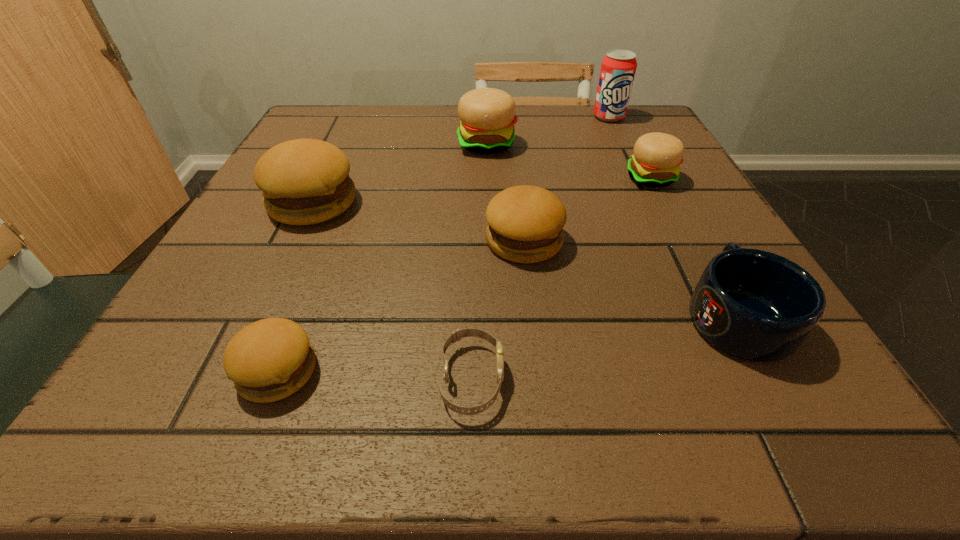
The width and height of the screenshot is (960, 540). What are the coordinates of `free space that is in between the soda can and the biggest brown hamburger` in the screenshot? It's located at (461, 160).

You are a GUI agent. You are given a task and a screenshot of the screen. Output one action in this format:
    pyautogui.click(x=<x>, y=<y>)
    Task: Click on the free space between the second smallest brown hamburger and the biggest brown hamburger
    
    Given the screenshot: What is the action you would take?
    pyautogui.click(x=419, y=221)

You are a GUI agent. You are given a task and a screenshot of the screen. Output one action in this format:
    pyautogui.click(x=<x>, y=<y>)
    Task: Click on the vacant region between the rightmost hamburger and the shortest object
    The image size is (960, 540).
    Given the screenshot: What is the action you would take?
    pyautogui.click(x=562, y=279)

Identify the location of vacant area that lies between the nearer beige hamburger and the blue mug. (693, 247).

This screenshot has height=540, width=960. What are the coordinates of `free space between the watch and the biggest brown hamburger` in the screenshot? It's located at (392, 291).

Find the location of a particular element. free space between the right beige hamburger and the biggest brown hamburger is located at coordinates (482, 191).

Image resolution: width=960 pixels, height=540 pixels. Identify the location of free space that is in between the watch and the mug. (604, 348).

I want to click on empty space between the second smallest brown hamburger and the watch, so click(498, 310).

The image size is (960, 540). What are the coordinates of `vacant point located between the biggest brown hamburger and the smaller beige hamburger` in the screenshot? It's located at (482, 191).

Where is `empty space between the blue mug and the watch`? This screenshot has width=960, height=540. empty space between the blue mug and the watch is located at coordinates 604,348.